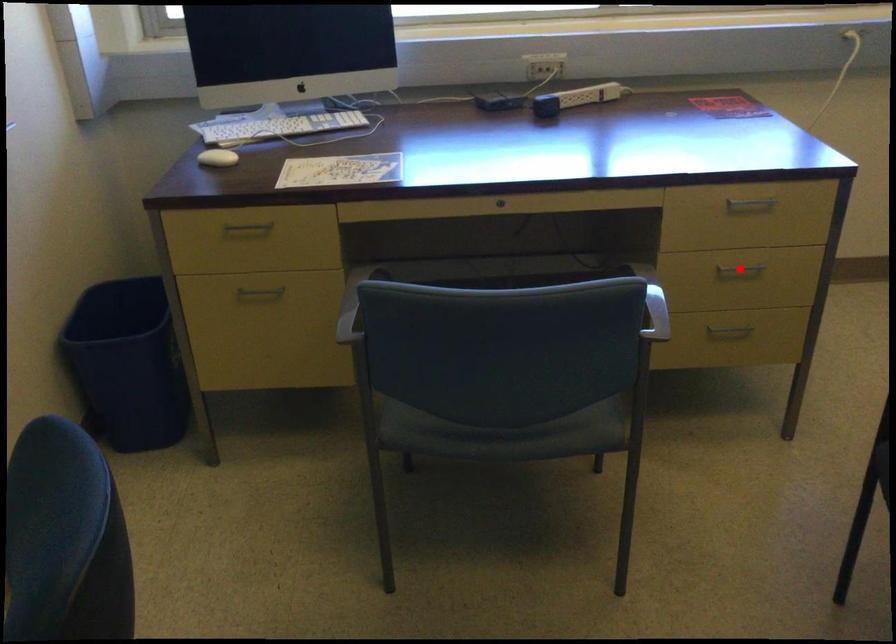
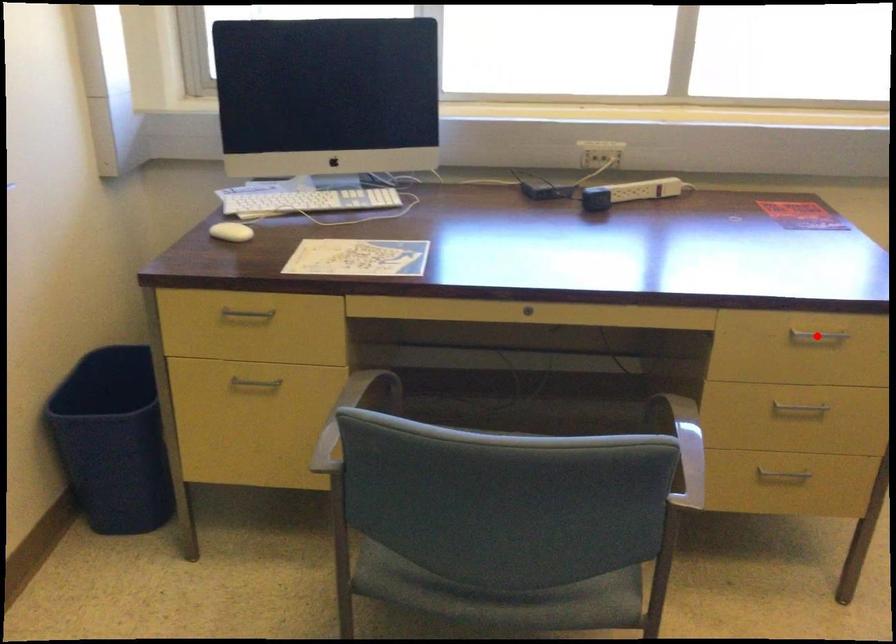
I am providing you with two images of the same scene from different viewpoints. A red point is marked on the first image and another point is marked on the second image. Is the marked point in image1 the same physical position as the marked point in image2?

No